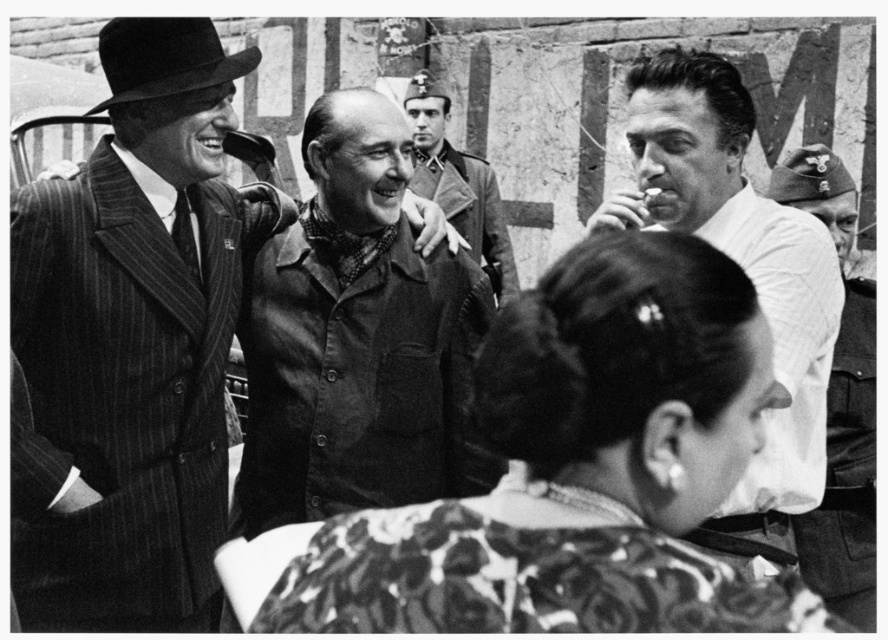
You are a photographer analyzing this black and white image. You notice the striped wool suit at center and the white matte shirt at upper right. Which of these two items is positioned lower in the image?

The striped wool suit at center is located below the white matte shirt at upper right, so the striped wool suit at center is positioned lower in the image.

You are a photographer reviewing this black and white image. You need to determine which object, the smooth leather hat at right or the smooth leather jacket at center, would cast a longer shadow given the lighting in the scene. Based on their positions and sizes, which one would have a longer shadow?

The smooth leather hat at right is taller than the smooth leather jacket at center, so it would cast a longer shadow.